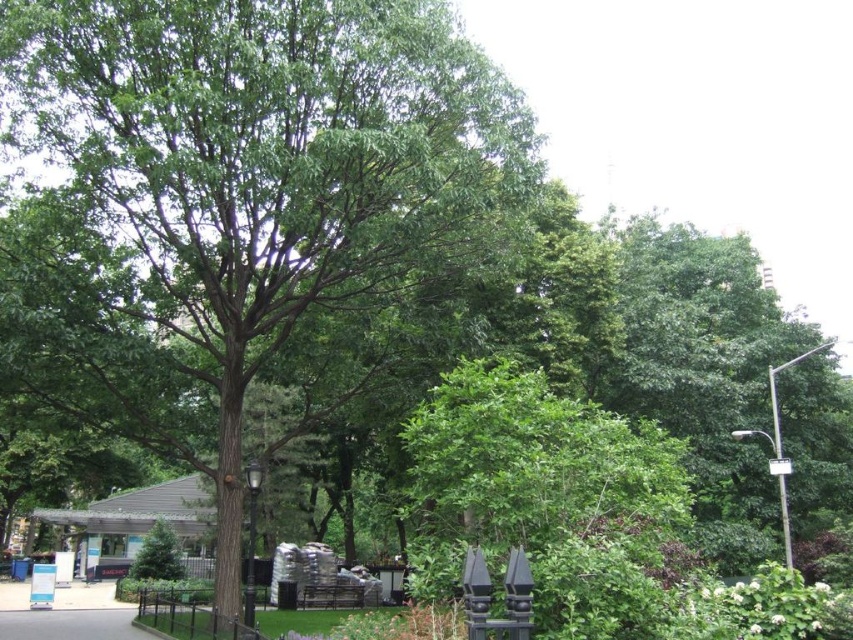
You are a gardener planning to install a new flower bed in the park. You notice the black metal fence at lower left and the gray asphalt pavement at lower left. Which object occupies more space in the scene?

The black metal fence at lower left has a larger size compared to the gray asphalt pavement at lower left, so the black metal fence occupies more space in the scene.

You are a gardener who needs to place a 5 feet wide flower bed between the black metal fence at lower left and the gray asphalt pavement at lower left. Is there enough space?

The black metal fence at lower left is 5.11 feet from the gray asphalt pavement at lower left, so yes, there is enough space to place a 5 feet wide flower bed between them since the distance is slightly more than the required width.